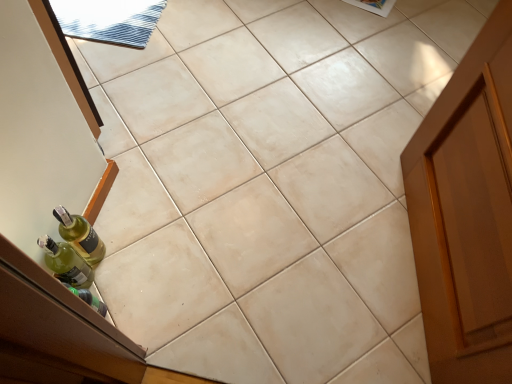
Describe the element at coordinates (66, 263) in the screenshot. I see `green glass bottle at left, marked as the 2th bottle in a top-to-bottom arrangement` at that location.

You are a GUI agent. You are given a task and a screenshot of the screen. Output one action in this format:
    pyautogui.click(x=<x>, y=<y>)
    Task: Click on the green glass bottle at left, marked as the 2th bottle in a top-to-bottom arrangement
    The height and width of the screenshot is (384, 512).
    Given the screenshot: What is the action you would take?
    pyautogui.click(x=66, y=263)

What do you see at coordinates (80, 235) in the screenshot? I see `green glass bottle at lower left, the first bottle viewed from the top` at bounding box center [80, 235].

Locate an element on the screen. The width and height of the screenshot is (512, 384). green glass bottle at lower left, the first bottle viewed from the top is located at coordinates (80, 235).

What are the coordinates of `green glass bottle at left, the first bottle in the bottom-to-top sequence` in the screenshot? It's located at (66, 263).

Which is more to the left, green glass bottle at lower left, the first bottle viewed from the top, or green glass bottle at left, marked as the 2th bottle in a top-to-bottom arrangement?

Positioned to the left is green glass bottle at left, marked as the 2th bottle in a top-to-bottom arrangement.

Which is behind, green glass bottle at lower left, the first bottle viewed from the top, or green glass bottle at left, the first bottle in the bottom-to-top sequence?

green glass bottle at lower left, the first bottle viewed from the top, is further from the camera.

Does point (73, 224) appear closer or farther from the camera than point (66, 246)?

Point (73, 224).

From the image's perspective, is green glass bottle at lower left, the first bottle viewed from the top, under green glass bottle at left, the first bottle in the bottom-to-top sequence?

No, from the image's perspective, green glass bottle at lower left, the first bottle viewed from the top, is not beneath green glass bottle at left, the first bottle in the bottom-to-top sequence.

From a real-world perspective, is green glass bottle at lower left, which is counted as the second bottle, starting from the bottom, positioned over green glass bottle at left, the first bottle in the bottom-to-top sequence, based on gravity?

No, from a real-world perspective, green glass bottle at lower left, which is counted as the second bottle, starting from the bottom, is not above green glass bottle at left, the first bottle in the bottom-to-top sequence.

Is green glass bottle at lower left, which is counted as the second bottle, starting from the bottom, thinner than green glass bottle at left, the first bottle in the bottom-to-top sequence?

No.

Is green glass bottle at lower left, the first bottle viewed from the top, taller than green glass bottle at left, marked as the 2th bottle in a top-to-bottom arrangement?

In fact, green glass bottle at lower left, the first bottle viewed from the top, may be shorter than green glass bottle at left, marked as the 2th bottle in a top-to-bottom arrangement.

Based on their sizes in the image, would you say green glass bottle at lower left, which is counted as the second bottle, starting from the bottom, is bigger or smaller than green glass bottle at left, marked as the 2th bottle in a top-to-bottom arrangement?

Considering their sizes, green glass bottle at lower left, which is counted as the second bottle, starting from the bottom, takes up more space than green glass bottle at left, marked as the 2th bottle in a top-to-bottom arrangement.

Is green glass bottle at left, the first bottle in the bottom-to-top sequence, inside green glass bottle at lower left, the first bottle viewed from the top?

That's incorrect, green glass bottle at left, the first bottle in the bottom-to-top sequence, is not inside green glass bottle at lower left, the first bottle viewed from the top.

Are green glass bottle at lower left, which is counted as the second bottle, starting from the bottom, and green glass bottle at left, marked as the 2th bottle in a top-to-bottom arrangement, making contact?

Indeed, green glass bottle at lower left, which is counted as the second bottle, starting from the bottom, and green glass bottle at left, marked as the 2th bottle in a top-to-bottom arrangement, are beside each other and touching.

Is green glass bottle at lower left, which is counted as the second bottle, starting from the bottom, aimed at green glass bottle at left, marked as the 2th bottle in a top-to-bottom arrangement?

Yes, green glass bottle at lower left, which is counted as the second bottle, starting from the bottom, is turned towards green glass bottle at left, marked as the 2th bottle in a top-to-bottom arrangement.

Where is `bottle in front of the green glass bottle at lower left, the first bottle viewed from the top`? This screenshot has height=384, width=512. bottle in front of the green glass bottle at lower left, the first bottle viewed from the top is located at coordinates (66, 263).

In the scene shown: Would you say green glass bottle at left, marked as the 2th bottle in a top-to-bottom arrangement, is to the left or to the right of green glass bottle at lower left, which is counted as the second bottle, starting from the bottom, in the picture?

green glass bottle at left, marked as the 2th bottle in a top-to-bottom arrangement, is positioned on green glass bottle at lower left, which is counted as the second bottle, starting from the bottom,'s left side.

Which object is further away from the camera taking this photo, green glass bottle at left, marked as the 2th bottle in a top-to-bottom arrangement, or green glass bottle at lower left, which is counted as the second bottle, starting from the bottom?

Positioned behind is green glass bottle at lower left, which is counted as the second bottle, starting from the bottom.

Is point (92, 277) less distant than point (78, 217)?

No.

From the image's perspective, would you say green glass bottle at left, marked as the 2th bottle in a top-to-bottom arrangement, is positioned over green glass bottle at lower left, which is counted as the second bottle, starting from the bottom?

No.

From a real-world perspective, is green glass bottle at left, marked as the 2th bottle in a top-to-bottom arrangement, positioned under green glass bottle at lower left, the first bottle viewed from the top, based on gravity?

No, from a real-world perspective, green glass bottle at left, marked as the 2th bottle in a top-to-bottom arrangement, is not beneath green glass bottle at lower left, the first bottle viewed from the top.

In terms of width, does green glass bottle at left, the first bottle in the bottom-to-top sequence, look wider or thinner when compared to green glass bottle at lower left, which is counted as the second bottle, starting from the bottom?

Considering their sizes, green glass bottle at left, the first bottle in the bottom-to-top sequence, looks slimmer than green glass bottle at lower left, which is counted as the second bottle, starting from the bottom.

Looking at this image, in terms of height, does green glass bottle at left, marked as the 2th bottle in a top-to-bottom arrangement, look taller or shorter compared to green glass bottle at lower left, the first bottle viewed from the top?

Considering their sizes, green glass bottle at left, marked as the 2th bottle in a top-to-bottom arrangement, has less height than green glass bottle at lower left, the first bottle viewed from the top.

Considering the relative sizes of green glass bottle at left, the first bottle in the bottom-to-top sequence, and green glass bottle at lower left, the first bottle viewed from the top, in the image provided, is green glass bottle at left, the first bottle in the bottom-to-top sequence, bigger than green glass bottle at lower left, the first bottle viewed from the top,?

Incorrect, green glass bottle at left, the first bottle in the bottom-to-top sequence, is not larger than green glass bottle at lower left, the first bottle viewed from the top.

Is green glass bottle at left, marked as the 2th bottle in a top-to-bottom arrangement, not within green glass bottle at lower left, the first bottle viewed from the top?

That's correct, green glass bottle at left, marked as the 2th bottle in a top-to-bottom arrangement, is outside of green glass bottle at lower left, the first bottle viewed from the top.

Is green glass bottle at left, marked as the 2th bottle in a top-to-bottom arrangement, not close to green glass bottle at lower left, the first bottle viewed from the top?

That's not correct — green glass bottle at left, marked as the 2th bottle in a top-to-bottom arrangement, is a little close to green glass bottle at lower left, the first bottle viewed from the top.

Is green glass bottle at left, marked as the 2th bottle in a top-to-bottom arrangement, positioned with its back to green glass bottle at lower left, which is counted as the second bottle, starting from the bottom?

Correct, green glass bottle at left, marked as the 2th bottle in a top-to-bottom arrangement, is looking away from green glass bottle at lower left, which is counted as the second bottle, starting from the bottom.

How distant is green glass bottle at left, marked as the 2th bottle in a top-to-bottom arrangement, from green glass bottle at lower left, the first bottle viewed from the top?

They are 1.88 inches apart.

Locate an element on the screen. Image resolution: width=512 pixels, height=384 pixels. bottle in front of the green glass bottle at lower left, the first bottle viewed from the top is located at coordinates (66, 263).

Where is `bottle lying in front of the green glass bottle at lower left, which is counted as the second bottle, starting from the bottom`? This screenshot has height=384, width=512. bottle lying in front of the green glass bottle at lower left, which is counted as the second bottle, starting from the bottom is located at coordinates (66, 263).

Find the location of `bottle that is below the green glass bottle at lower left, the first bottle viewed from the top (from the image's perspective)`. bottle that is below the green glass bottle at lower left, the first bottle viewed from the top (from the image's perspective) is located at coordinates (66, 263).